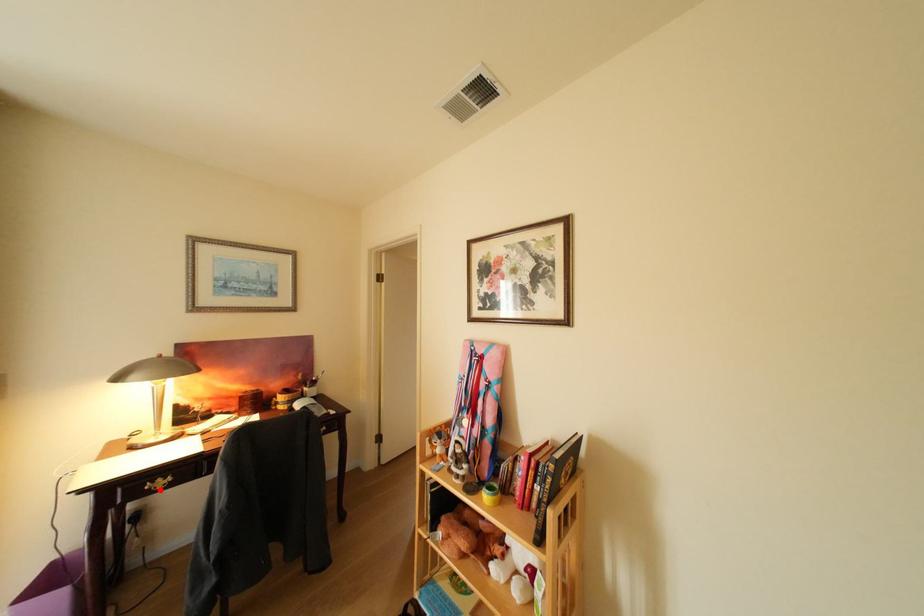
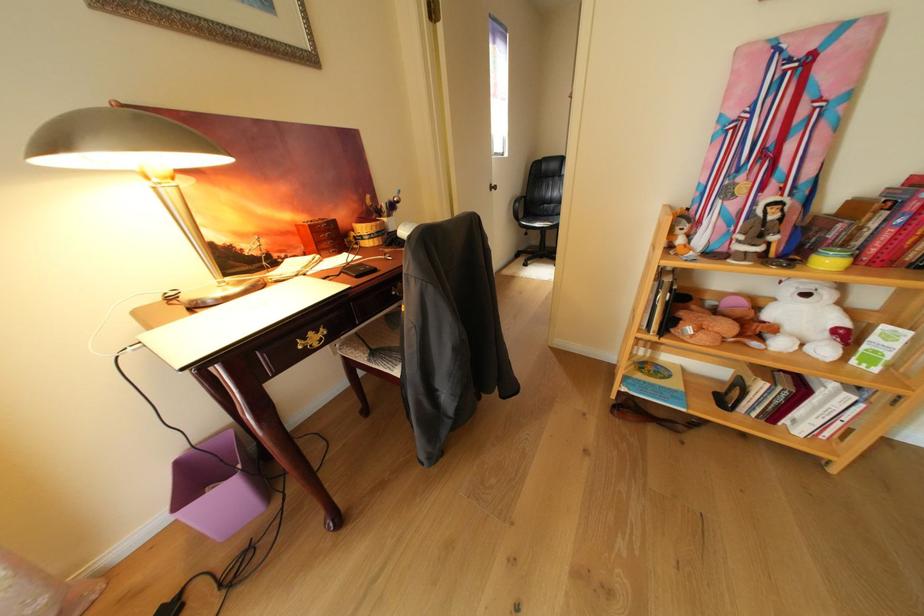
Locate, in the second image, the point that corresponds to the highlighted location in the first image.

(312, 349)